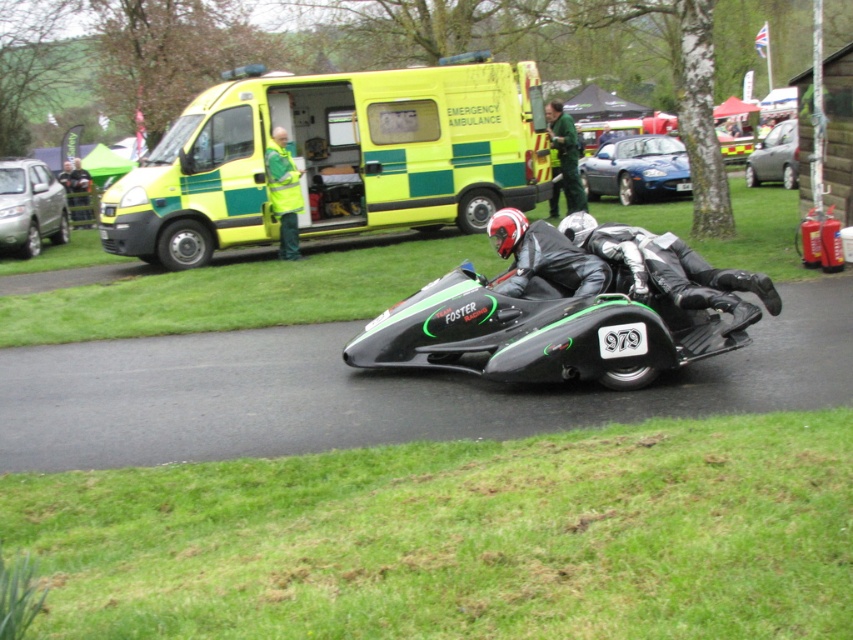
You are a photographer at the motorsport event. You need to capture a photo of both the black leather suit at center and the shiny black helmet at center. Based on their positions, which object should you focus on first to ensure both are in frame?

The black leather suit at center is to the right of the shiny black helmet at center, so you should focus on the shiny black helmet at center first to ensure both are in frame.

You are standing at the point marked by coordinates point (505, 208) and want to walk to the nearest exit, which is located 20 meters away from your current position. Can you safely reach the exit without exceeding the 20 meter limit?

The distance between point (505, 208) and the viewer is 16.59 meters, which is within the 20 meter limit. Therefore, you can safely reach the exit.

Looking at this image, you are a spectator at the motorsport event and want to take a photo of the motorcycle with sidecar. The motorcycle is at point (515, 259) and the sidecar is at point (47, 177). To ensure both are in frame, which point should you focus on first?

You should focus on point (515, 259) first because it is in front of point (47, 177), ensuring both the motorcycle and sidecar are captured in the photo.